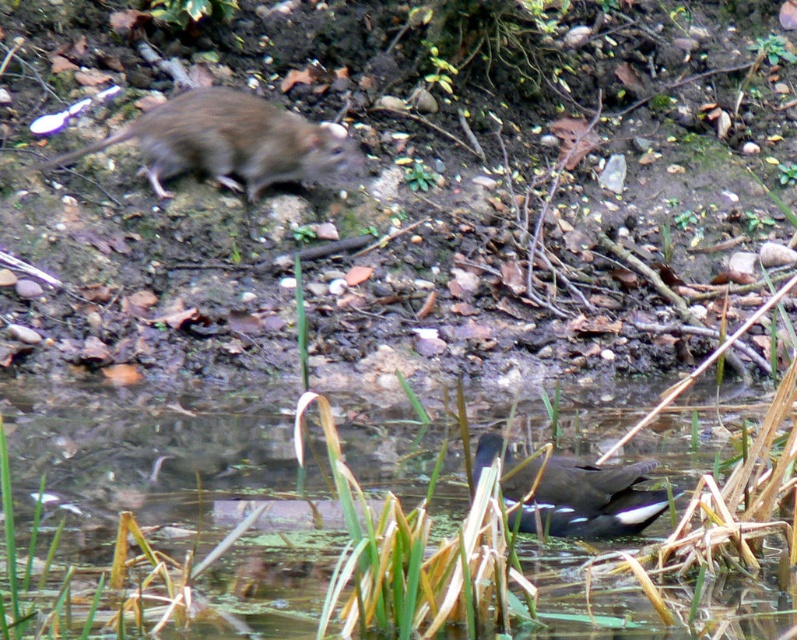
Which is more to the left, translucent water at center or dark brown feathers at lower center?

translucent water at center

Between translucent water at center and dark brown feathers at lower center, which one is positioned higher?

dark brown feathers at lower center

This screenshot has width=797, height=640. What are the coordinates of `translucent water at center` in the screenshot? It's located at (179, 486).

Between point (709, 611) and point (211, 99), which one is positioned in front?

Point (709, 611)

Between translucent water at center and fur-like gray rat at upper left, which one has more height?

fur-like gray rat at upper left is taller.

Which is behind, point (84, 534) or point (57, 161)?

Positioned behind is point (57, 161).

The width and height of the screenshot is (797, 640). What are the coordinates of `translucent water at center` in the screenshot? It's located at (179, 486).

Between point (256, 145) and point (635, 513), which one is positioned behind?

Positioned behind is point (256, 145).

Does fur-like gray rat at upper left appear over dark brown feathers at lower center?

Yes, fur-like gray rat at upper left is above dark brown feathers at lower center.

The image size is (797, 640). Describe the element at coordinates (232, 141) in the screenshot. I see `fur-like gray rat at upper left` at that location.

Locate an element on the screen. fur-like gray rat at upper left is located at coordinates (232, 141).